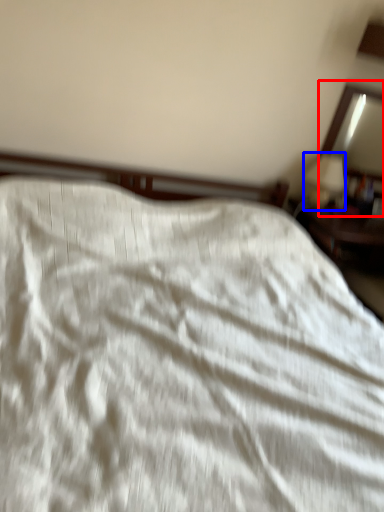
Question: Which object is closer to the camera taking this photo, mirror (highlighted by a red box) or table lamp (highlighted by a blue box)?

Choices:
 (A) mirror
 (B) table lamp

Answer: (B)